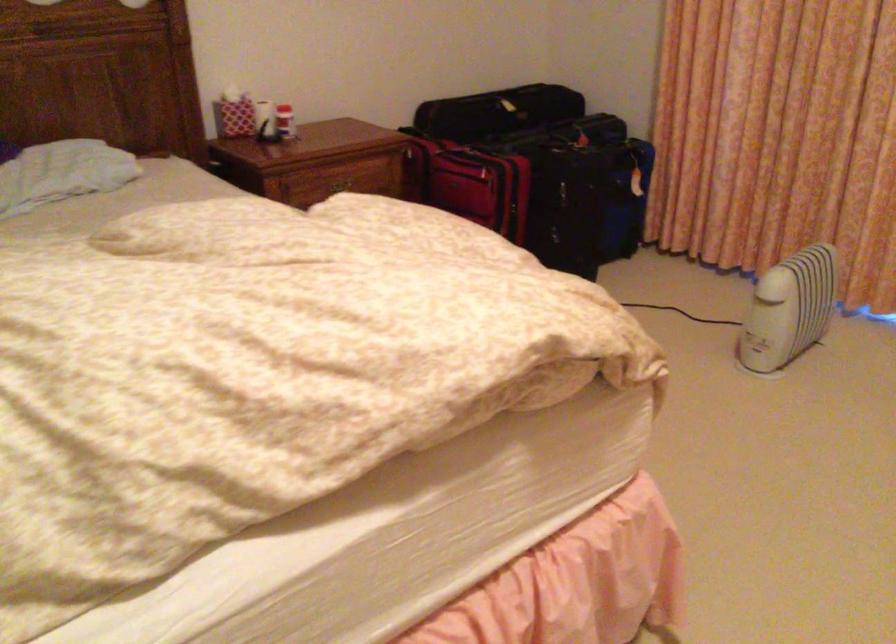
This screenshot has height=644, width=896. What do you see at coordinates (649, 223) in the screenshot?
I see `the black suitcase handle` at bounding box center [649, 223].